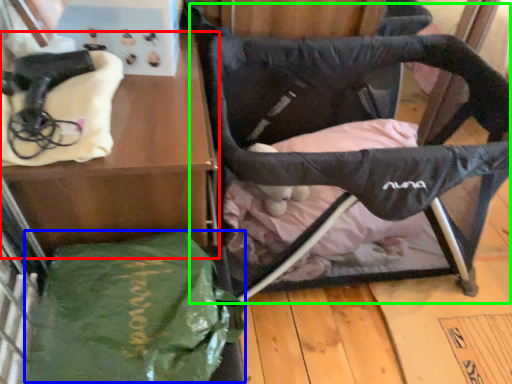
Question: Which object is the closest to the furniture (highlighted by a red box)? Choose among these: tote bag (highlighted by a blue box) or swivel chair (highlighted by a green box).

Choices:
 (A) tote bag
 (B) swivel chair

Answer: (A)